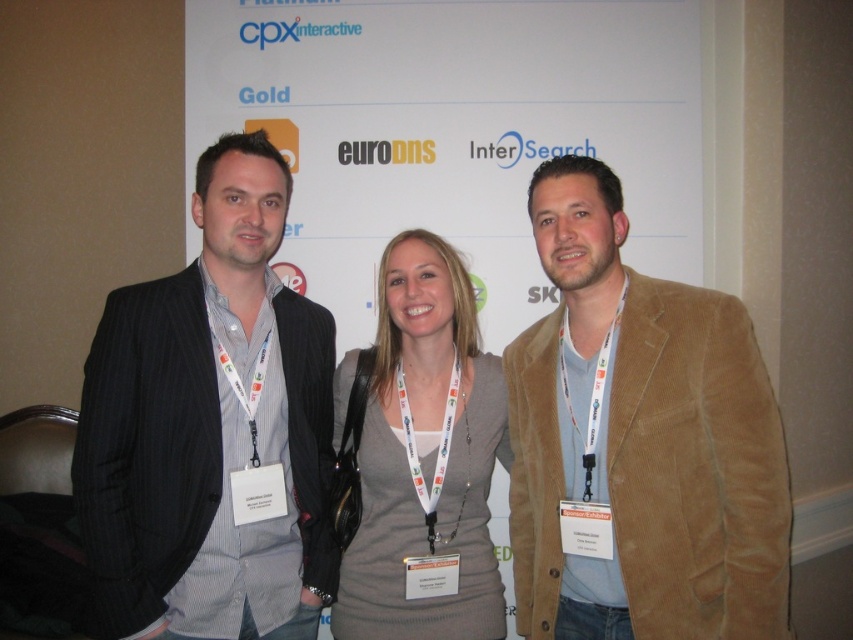
Question: Which point is farther to the camera?

Choices:
 (A) dark gray pinstripe suit at left
 (B) white lanyard at center
 (C) gray knitted sweater at center

Answer: (B)

Question: Which point is closer to the camera taking this photo?

Choices:
 (A) (242, 298)
 (B) (585, 465)
 (C) (421, 474)
 (D) (622, 609)

Answer: (D)

Question: Can you confirm if corduroy brown blazer at center is positioned to the left of white fabric lanyard at right?

Choices:
 (A) yes
 (B) no

Answer: (B)

Question: Considering the relative positions of dark gray pinstripe suit at left and white fabric lanyard at right in the image provided, where is dark gray pinstripe suit at left located with respect to white fabric lanyard at right?

Choices:
 (A) left
 (B) right

Answer: (A)

Question: Estimate the real-world distances between objects in this image. Which object is closer to the gray knitted sweater at center?

Choices:
 (A) dark gray pinstripe suit at left
 (B) corduroy brown blazer at center

Answer: (A)

Question: Does dark gray pinstripe suit at left have a greater width compared to white fabric lanyard at right?

Choices:
 (A) yes
 (B) no

Answer: (A)